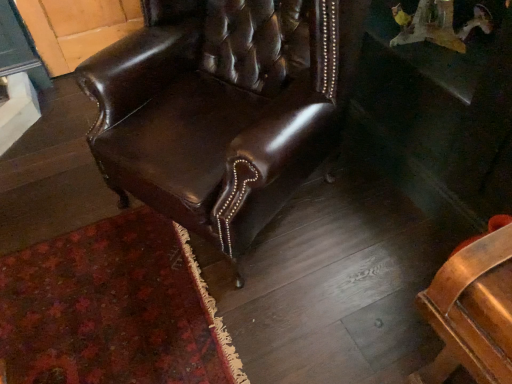
At what (x,y) coordinates should I click in order to perform the action: click on free space to the left of shiny brown leather chair at center. Please return your answer as a coordinate pair (x, y). Looking at the image, I should click on (65, 214).